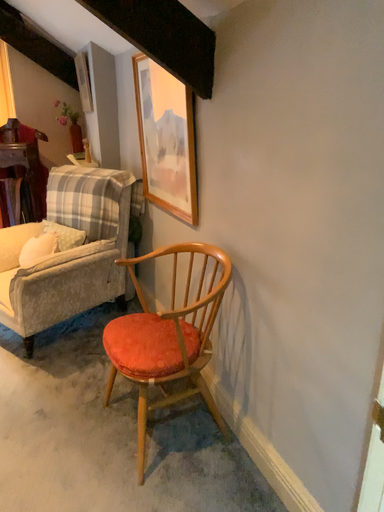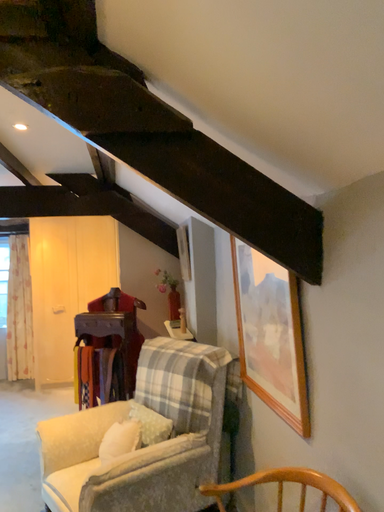
Question: How did the camera likely rotate when shooting the video?

Choices:
 (A) rotated downward
 (B) rotated upward

Answer: (B)